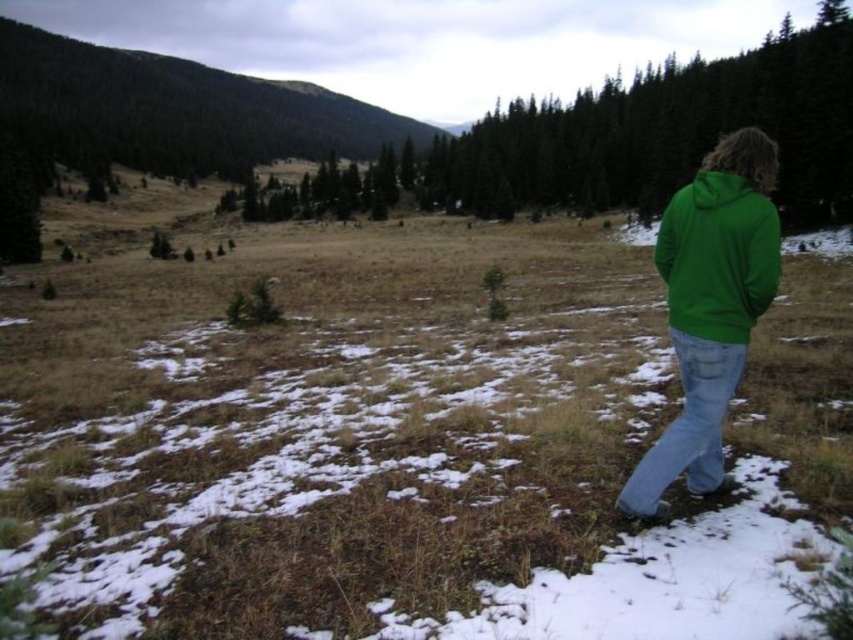
Question: Which object is positioned farthest from the green fleece jacket at right?

Choices:
 (A) green matte tree at upper center
 (B) green fabric jacket at right

Answer: (A)

Question: Which point is farther from the camera taking this photo?

Choices:
 (A) (809, 282)
 (B) (746, 196)

Answer: (A)

Question: Is green matte tree at upper center thinner than green fleece jacket at right?

Choices:
 (A) yes
 (B) no

Answer: (B)

Question: Can you confirm if green matte tree at upper center is bigger than green fleece sweatshirt at right?

Choices:
 (A) yes
 (B) no

Answer: (A)

Question: Is green fleece jacket at right bigger than green fleece sweatshirt at right?

Choices:
 (A) no
 (B) yes

Answer: (B)

Question: Which point appears closest to the camera in this image?

Choices:
 (A) [672, 218]
 (B) [495, 115]

Answer: (A)